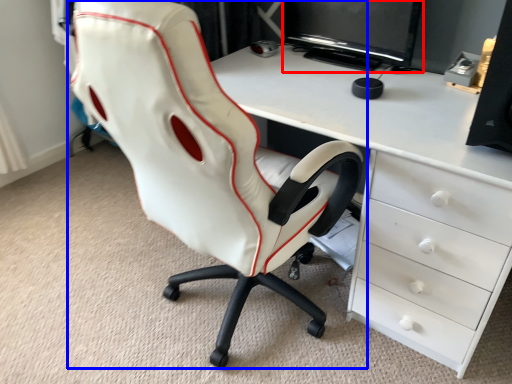
Question: Which point is closer to the camera, computer monitor (highlighted by a red box) or chair (highlighted by a blue box)?

Choices:
 (A) computer monitor
 (B) chair

Answer: (B)